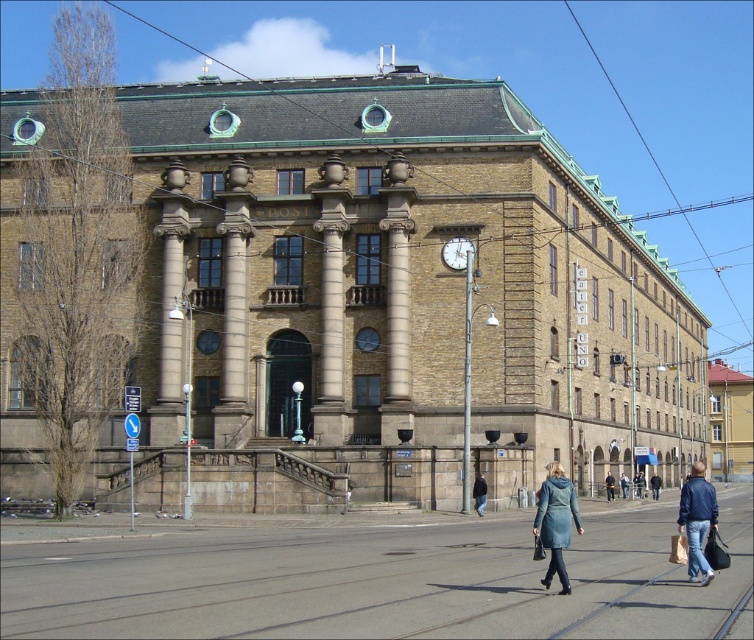
Question: Considering the real-world distances, which object is closest to the brass metallic clock at center?

Choices:
 (A) denim jacket at lower right
 (B) teal fabric coat at lower center
 (C) blue denim jacket at lower right
 (D) black leather jacket at lower center

Answer: (B)

Question: Is denim jacket at lower right to the left of black leather jacket at lower center from the viewer's perspective?

Choices:
 (A) yes
 (B) no

Answer: (B)

Question: Where is blue denim jacket at lower right located in relation to brass metallic clock at center in the image?

Choices:
 (A) left
 (B) right

Answer: (B)

Question: Among these objects, which one is farthest from the camera?

Choices:
 (A) brass metallic clock at center
 (B) teal fabric coat at lower center
 (C) blue denim jacket at lower right
 (D) denim jacket at lower right

Answer: (D)

Question: Which of the following is the farthest from the observer?

Choices:
 (A) (449, 259)
 (B) (538, 536)

Answer: (A)

Question: Does brass metallic clock at center have a larger size compared to black leather jacket at lower center?

Choices:
 (A) no
 (B) yes

Answer: (B)